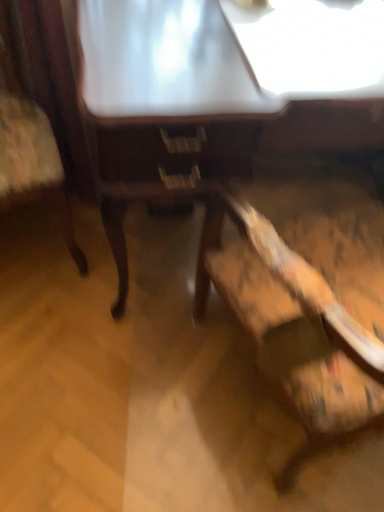
Image resolution: width=384 pixels, height=512 pixels. In order to click on unoccupied region to the right of wooden chair at left, the first chair positioned from the left in this screenshot , I will do `click(130, 259)`.